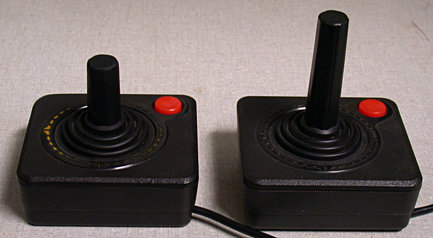
Locate an element on the screen. game controller is located at coordinates (152, 158), (272, 167).